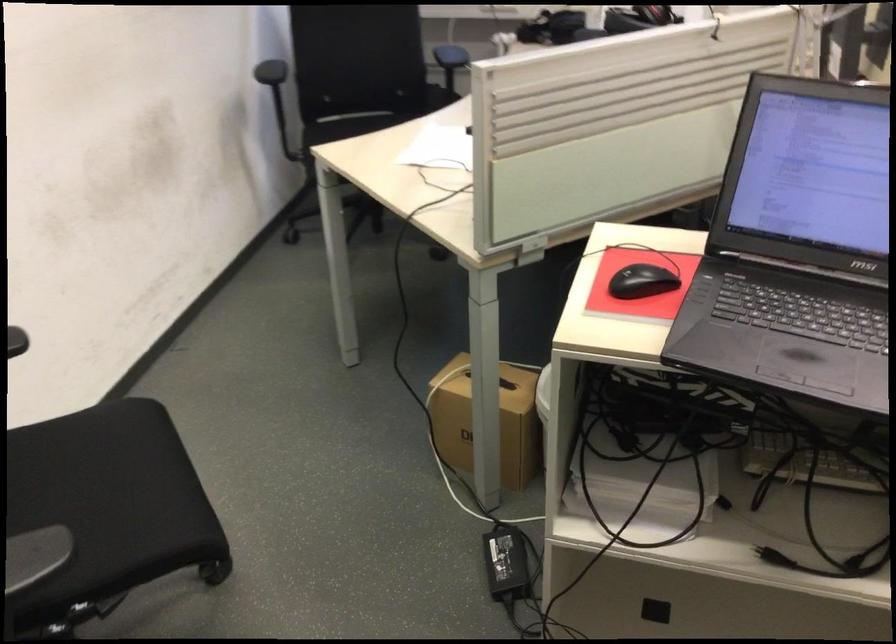
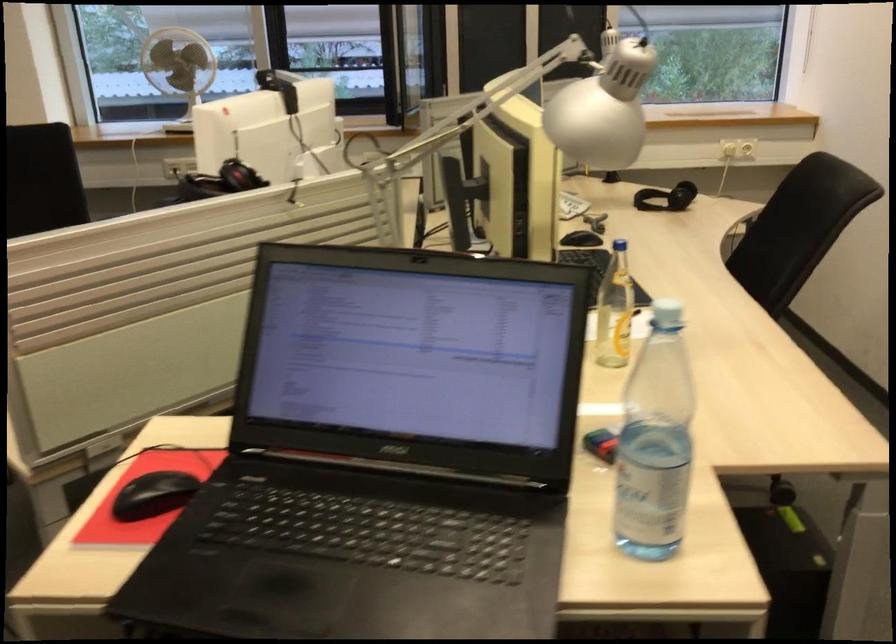
Question: The images are taken continuously from a first-person perspective. In which direction are you moving?

Choices:
 (A) Left
 (B) Right
 (C) Forward
 (D) Backward

Answer: (B)